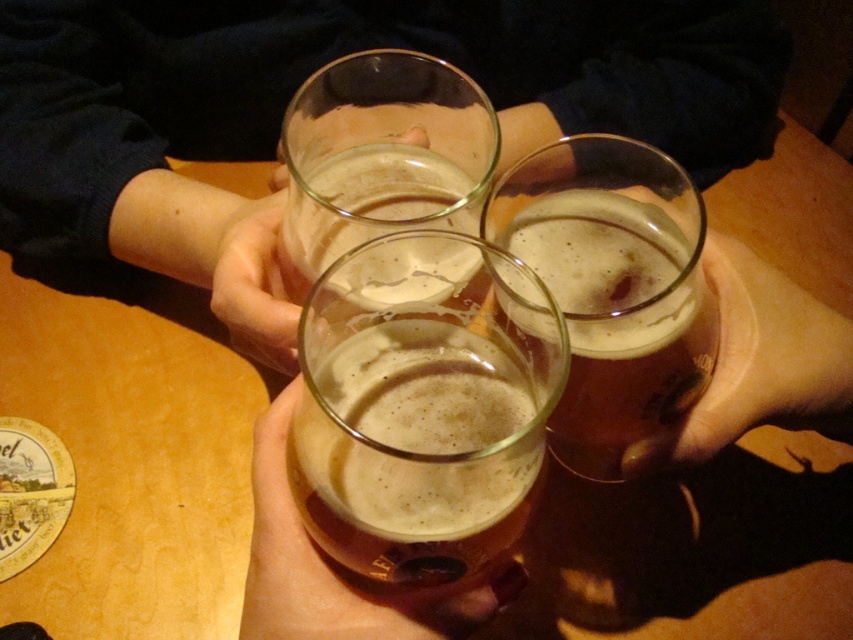
You are at a bar and see a point at coordinates (618, 310). What object is located at that point?

The point at coordinates (618, 310) corresponds to the amber glass beer at center.

You are at a bar and see two points on the table. The first point is at coordinate point (675, 154) and the second is at point (672, 323). If you want to place a coaster between them, which point should you place it closer to?

You should place the coaster closer to point (672, 323) because point (675, 154) is behind it.